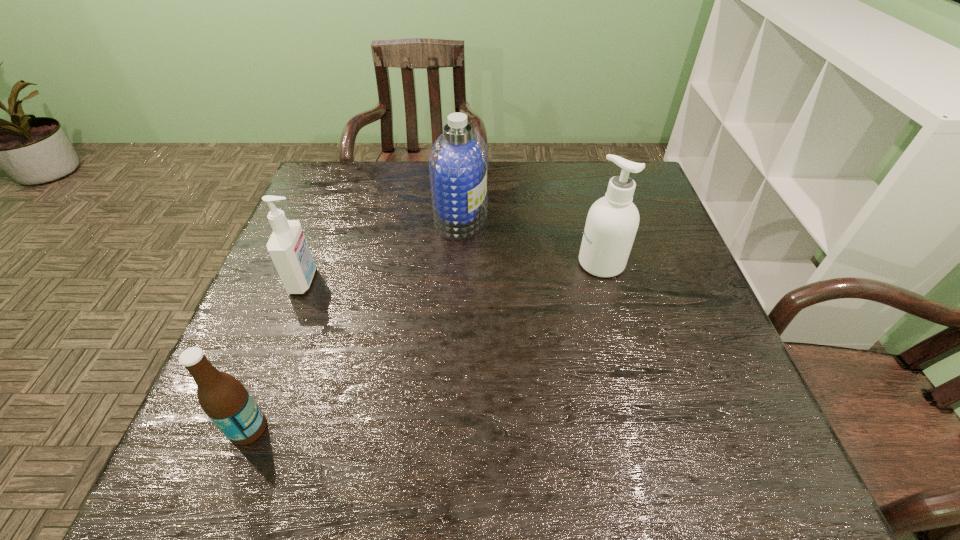
At what (x,y) coordinates should I click in order to perform the action: click on vacant point that satisfies the following two spatial constraints: 1. on the back side of the beer bottle; 2. on the front label of the leftmost cleansing agent. Please return your answer as a coordinate pair (x, y). This screenshot has width=960, height=540. Looking at the image, I should click on [x=304, y=280].